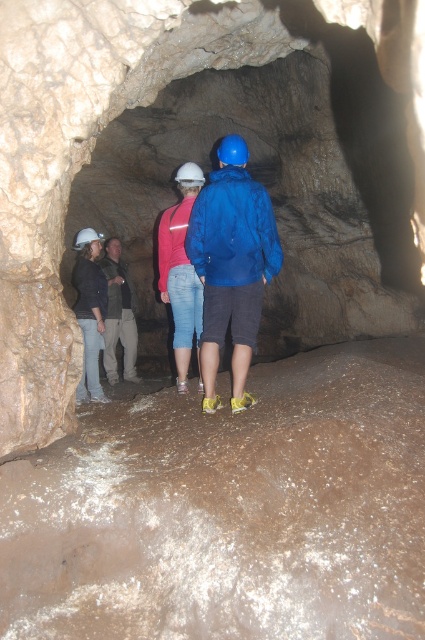
Is point (227, 160) less distant than point (184, 182)?

That is True.

Which of these two, blue matte helmet at center or white matte helmet at center, stands taller?

Standing taller between the two is white matte helmet at center.

What are the coordinates of `blue matte helmet at center` in the screenshot? It's located at (232, 150).

The height and width of the screenshot is (640, 425). I want to click on blue matte helmet at center, so click(x=232, y=150).

Based on the photo, which is more to the right, blue matte jacket at center or white matte helmet at left?

From the viewer's perspective, blue matte jacket at center appears more on the right side.

Is the position of blue matte jacket at center less distant than that of white matte helmet at left?

Yes, it is in front of white matte helmet at left.

Identify the location of blue matte jacket at center. The height and width of the screenshot is (640, 425). (232, 273).

Is denim pants at center to the right of white matte helmet at left from the viewer's perspective?

No, denim pants at center is not to the right of white matte helmet at left.

The height and width of the screenshot is (640, 425). I want to click on denim pants at center, so click(x=119, y=316).

Who is more distant from viewer, [110,352] or [96,237]?

The point [110,352] is behind.

Identify the location of denim pants at center. The image size is (425, 640). (119, 316).